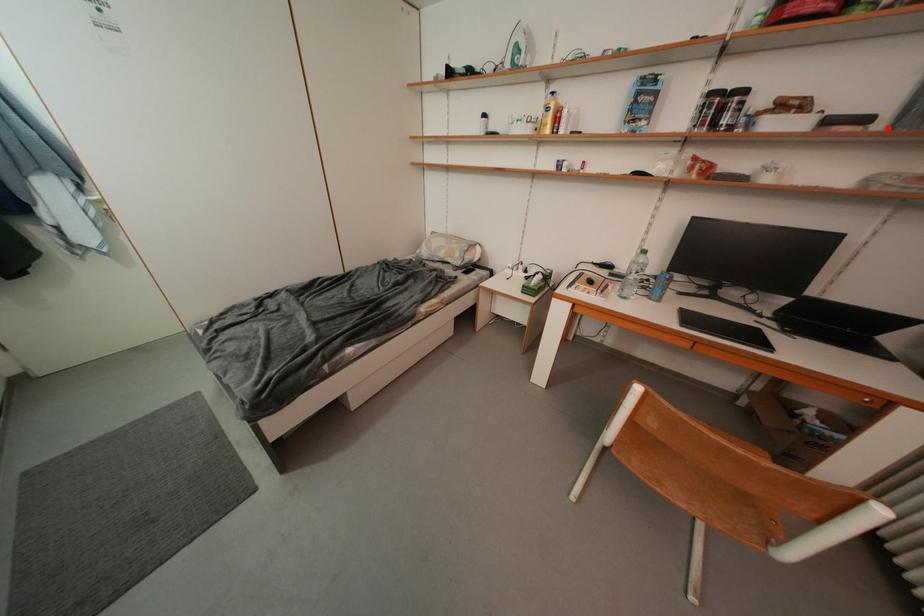
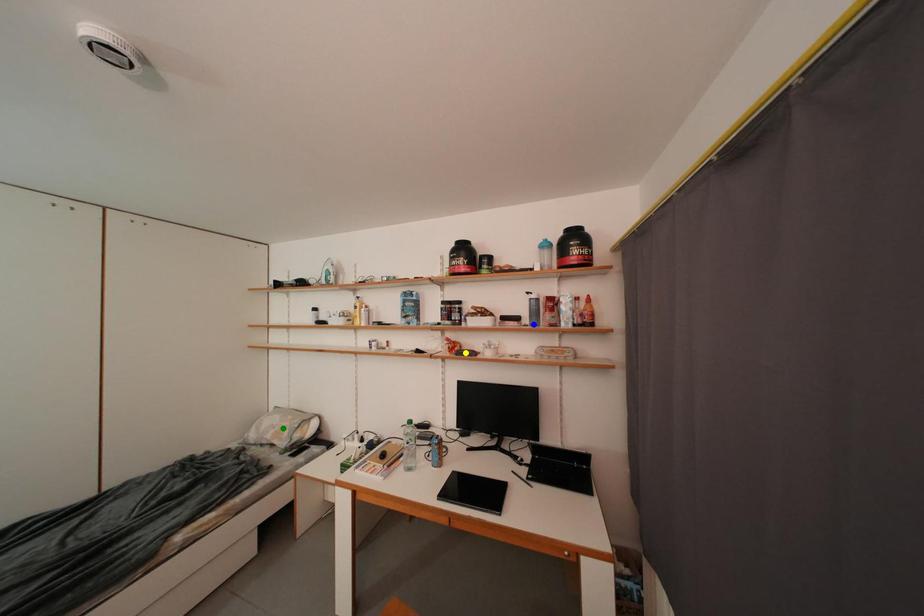
Question: I am providing you with two images of the same scene from different viewpoints. A red point is marked on the first image. You are given multiple points on the second image. Which spot in image 2 lines up with the point in image 1?

Choices:
 (A) blue point
 (B) green point
 (C) yellow point

Answer: (A)